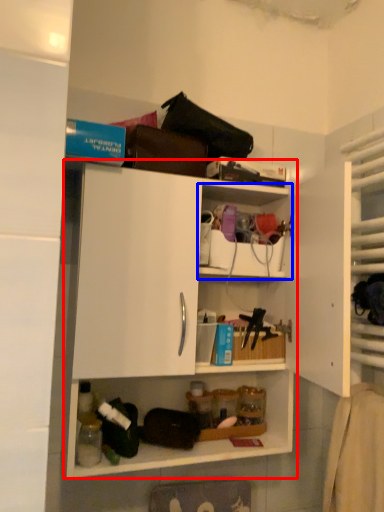
Question: Among these objects, which one is nearest to the camera, shelf (highlighted by a red box) or shelf (highlighted by a blue box)?

Choices:
 (A) shelf
 (B) shelf

Answer: (A)